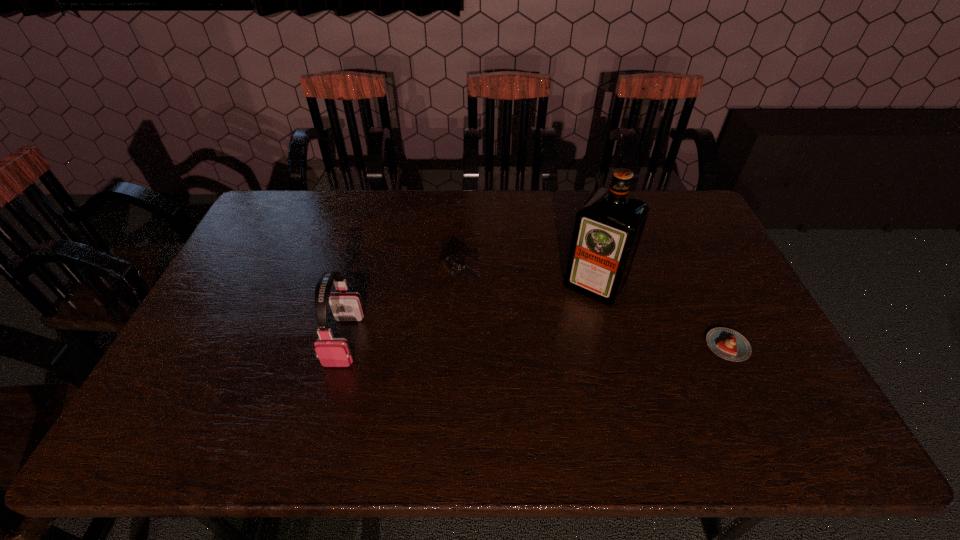
The width and height of the screenshot is (960, 540). In order to click on free space at the far right corner in this screenshot , I will do `click(685, 193)`.

Find the location of a particular element. The image size is (960, 540). free space between the second tallest object and the third object from left to right is located at coordinates (469, 313).

Find the location of a particular element. This screenshot has height=540, width=960. free spot between the earphone and the second shortest object is located at coordinates (401, 313).

The height and width of the screenshot is (540, 960). I want to click on vacant point located between the earphone and the shortest object, so click(536, 343).

Find the location of `free space between the pistol and the shortest object`. free space between the pistol and the shortest object is located at coordinates click(593, 315).

I want to click on vacant region between the second tallest object and the shortest object, so click(536, 343).

I want to click on vacant area that lies between the earphone and the liquor, so click(x=469, y=313).

Locate an element on the screen. The height and width of the screenshot is (540, 960). vacant space that is in between the second tallest object and the rightmost object is located at coordinates [536, 343].

Identify the location of free spot between the pastry and the third shortest object. (536, 343).

Where is `free spot between the leftmost object and the tallest object`? free spot between the leftmost object and the tallest object is located at coordinates (469, 313).